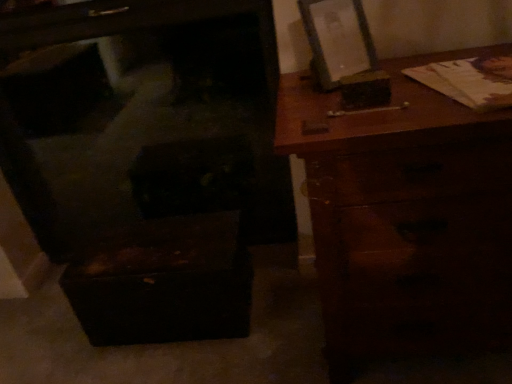
Locate an element on the screen. This screenshot has height=384, width=512. wooden picture frame at upper right is located at coordinates (337, 38).

In the scene shown: What is the approximate width of brown wooden chest of drawers at right?

The width of brown wooden chest of drawers at right is 20.20 inches.

The width and height of the screenshot is (512, 384). Describe the element at coordinates (141, 115) in the screenshot. I see `wooden chest at lower left` at that location.

Find the location of a particular element. This screenshot has height=384, width=512. wooden picture frame at upper right is located at coordinates (337, 38).

Which is more to the left, brown wooden chest of drawers at right or wooden picture frame at upper right?

wooden picture frame at upper right is more to the left.

From a real-world perspective, is brown wooden chest of drawers at right positioned above or below wooden picture frame at upper right?

brown wooden chest of drawers at right is situated lower than wooden picture frame at upper right in the real world.

Consider the image. Is brown wooden chest of drawers at right positioned with its back to wooden picture frame at upper right?

That's not correct — brown wooden chest of drawers at right is not looking away from wooden picture frame at upper right.

Is there a large distance between wooden chest at lower left and brown wooden chest of drawers at right?

No, wooden chest at lower left is in close proximity to brown wooden chest of drawers at right.

Between wooden chest at lower left and brown wooden chest of drawers at right, which one appears on the left side from the viewer's perspective?

Positioned to the left is wooden chest at lower left.

Is wooden chest at lower left oriented towards brown wooden chest of drawers at right?

No, wooden chest at lower left is not oriented towards brown wooden chest of drawers at right.

Is point (114, 106) positioned after point (317, 244)?

Yes, point (114, 106) is farther from viewer.

Based on the photo, considering the positions of objects wooden chest at lower left and wooden picture frame at upper right in the image provided, who is more to the left, wooden chest at lower left or wooden picture frame at upper right?

From the viewer's perspective, wooden chest at lower left appears more on the left side.

From the image's perspective, is wooden chest at lower left located above or below wooden picture frame at upper right?

wooden chest at lower left is situated lower than wooden picture frame at upper right in the image.

Is wooden chest at lower left not close to wooden picture frame at upper right?

wooden chest at lower left is far away from wooden picture frame at upper right.

This screenshot has width=512, height=384. What are the coordinates of `picture frame above the wooden chest at lower left (from the image's perspective)` in the screenshot? It's located at (337, 38).

Can you tell me how much wooden picture frame at upper right and brown wooden chest of drawers at right differ in facing direction?

→ wooden picture frame at upper right and brown wooden chest of drawers at right are facing 35.5 degrees away from each other.

Is wooden picture frame at upper right facing towards brown wooden chest of drawers at right?

No, wooden picture frame at upper right does not turn towards brown wooden chest of drawers at right.

Would you say wooden picture frame at upper right is inside or outside brown wooden chest of drawers at right?

wooden picture frame at upper right is outside brown wooden chest of drawers at right.

From a real-world perspective, is wooden picture frame at upper right positioned under brown wooden chest of drawers at right based on gravity?

No, from a real-world perspective, wooden picture frame at upper right is not under brown wooden chest of drawers at right.

Are brown wooden chest of drawers at right and wooden chest at lower left making contact?

brown wooden chest of drawers at right and wooden chest at lower left are not in contact.

From the image's perspective, which object appears higher, brown wooden chest of drawers at right or wooden chest at lower left?

wooden chest at lower left, from the image's perspective.

Looking at this image, how different are the orientations of brown wooden chest of drawers at right and wooden chest at lower left in degrees?

There is a 0.917-degree angle between the facing directions of brown wooden chest of drawers at right and wooden chest at lower left.

Is brown wooden chest of drawers at right taller or shorter than wooden chest at lower left?

Considering their sizes, brown wooden chest of drawers at right has less height than wooden chest at lower left.

Does wooden picture frame at upper right have a lesser height compared to wooden chest at lower left?

Yes, wooden picture frame at upper right is shorter than wooden chest at lower left.

Would you say wooden picture frame at upper right is outside wooden chest at lower left?

Absolutely, wooden picture frame at upper right is external to wooden chest at lower left.

From a real-world perspective, is wooden picture frame at upper right on wooden chest at lower left?

Yes, from a real-world perspective, wooden picture frame at upper right is on top of wooden chest at lower left.

Is wooden picture frame at upper right in contact with wooden chest at lower left?

No, wooden picture frame at upper right is not beside wooden chest at lower left.

Find the location of a particular element. This screenshot has width=512, height=384. the chest of drawers below the wooden picture frame at upper right (from a real-world perspective) is located at coordinates (406, 217).

Where is `furniture on the left of the brown wooden chest of drawers at right`? The height and width of the screenshot is (384, 512). furniture on the left of the brown wooden chest of drawers at right is located at coordinates [x=141, y=115].

From the picture: Which object lies nearer to the anchor point wooden chest at lower left, wooden picture frame at upper right or brown wooden chest of drawers at right?

brown wooden chest of drawers at right.

Considering their positions, is wooden picture frame at upper right positioned further to brown wooden chest of drawers at right than wooden chest at lower left?

wooden chest at lower left.

From the image, which object appears to be farther from wooden picture frame at upper right, wooden chest at lower left or brown wooden chest of drawers at right?

wooden chest at lower left.

Based on their spatial positions, is brown wooden chest of drawers at right or wooden chest at lower left further from wooden picture frame at upper right?

The object further to wooden picture frame at upper right is wooden chest at lower left.

Based on their spatial positions, is brown wooden chest of drawers at right or wooden picture frame at upper right closer to wooden chest at lower left?

brown wooden chest of drawers at right lies closer to wooden chest at lower left than the other object.

Based on their spatial positions, is wooden chest at lower left or wooden picture frame at upper right further from brown wooden chest of drawers at right?

wooden chest at lower left is positioned further to the anchor brown wooden chest of drawers at right.

Locate an element on the screen. This screenshot has height=384, width=512. picture frame situated between wooden chest at lower left and brown wooden chest of drawers at right from left to right is located at coordinates (337, 38).